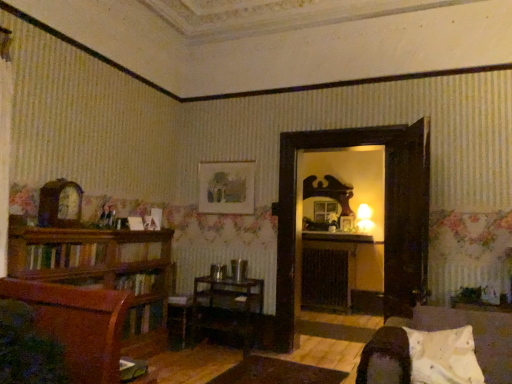
Question: Are white soft pillow at lower right and black matte fireplace at center located far from each other?

Choices:
 (A) yes
 (B) no

Answer: (A)

Question: Does white soft pillow at lower right appear on the right side of black matte fireplace at center?

Choices:
 (A) yes
 (B) no

Answer: (B)

Question: Is black matte fireplace at center completely or partially inside white soft pillow at lower right?

Choices:
 (A) yes
 (B) no

Answer: (B)

Question: Is black matte fireplace at center at the back of white soft pillow at lower right?

Choices:
 (A) yes
 (B) no

Answer: (A)

Question: From the image's perspective, does white soft pillow at lower right appear higher than black matte fireplace at center?

Choices:
 (A) yes
 (B) no

Answer: (A)

Question: Looking at the image, does black matte fireplace at center seem bigger or smaller compared to mahogany wood bookshelf at left?

Choices:
 (A) small
 (B) big

Answer: (A)

Question: Looking at their shapes, would you say black matte fireplace at center is wider or thinner than mahogany wood bookshelf at left?

Choices:
 (A) wide
 (B) thin

Answer: (B)

Question: From a real-world perspective, is black matte fireplace at center above or below mahogany wood bookshelf at left?

Choices:
 (A) above
 (B) below

Answer: (B)

Question: Do you think black matte fireplace at center is within mahogany wood bookshelf at left, or outside of it?

Choices:
 (A) outside
 (B) inside

Answer: (A)

Question: Considering their positions, is velvet dark brown chair at lower right located in front of or behind white soft pillow at lower right?

Choices:
 (A) behind
 (B) front

Answer: (B)

Question: Is velvet dark brown chair at lower right inside the boundaries of white soft pillow at lower right, or outside?

Choices:
 (A) inside
 (B) outside

Answer: (B)

Question: From the image's perspective, is velvet dark brown chair at lower right positioned above or below white soft pillow at lower right?

Choices:
 (A) below
 (B) above

Answer: (A)

Question: From a real-world perspective, is velvet dark brown chair at lower right positioned above or below white soft pillow at lower right?

Choices:
 (A) above
 (B) below

Answer: (B)

Question: From a real-world perspective, is white soft pillow at lower right physically located above or below wooden table at center?

Choices:
 (A) below
 (B) above

Answer: (B)

Question: In terms of height, does white soft pillow at lower right look taller or shorter compared to wooden table at center?

Choices:
 (A) tall
 (B) short

Answer: (B)